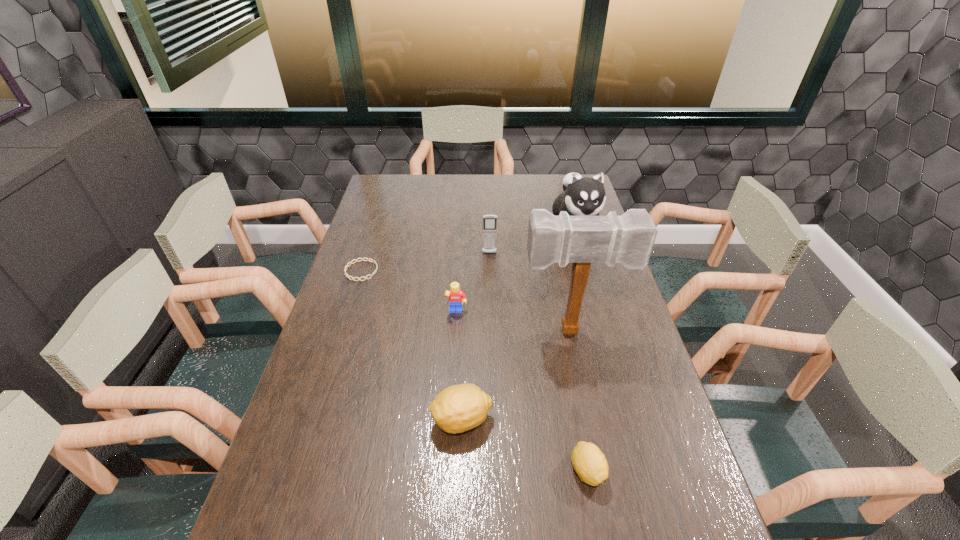
Identify the location of free space that is in between the third tallest object and the nearer lemon. (539, 362).

Find the location of `unoccupied area between the sixth farthest object and the leftmost object`. unoccupied area between the sixth farthest object and the leftmost object is located at coordinates (412, 346).

Find the location of a particular element. object that is the fifth nearest to the cellular telephone is located at coordinates (459, 408).

Identify which object is located as the fourth nearest to the bracelet. Please provide its 2D coordinates. Your answer should be formatted as a tuple, i.e. [(x, y)], where the tuple contains the x and y coordinates of a point satisfying the conditions above.

[(459, 408)]

I want to click on free space that satisfies the following two spatial constraints: 1. at the face of the second tallest object; 2. at the stem end of the left lemon, so click(630, 420).

What are the coordinates of `free location that satisfies the following two spatial constraints: 1. at the face of the second tallest object; 2. at the stem end of the taller lemon` in the screenshot? It's located at (630, 420).

I want to click on free space that satisfies the following two spatial constraints: 1. on the face of the mallet; 2. on the right side of the fourth nearest object, so click(455, 330).